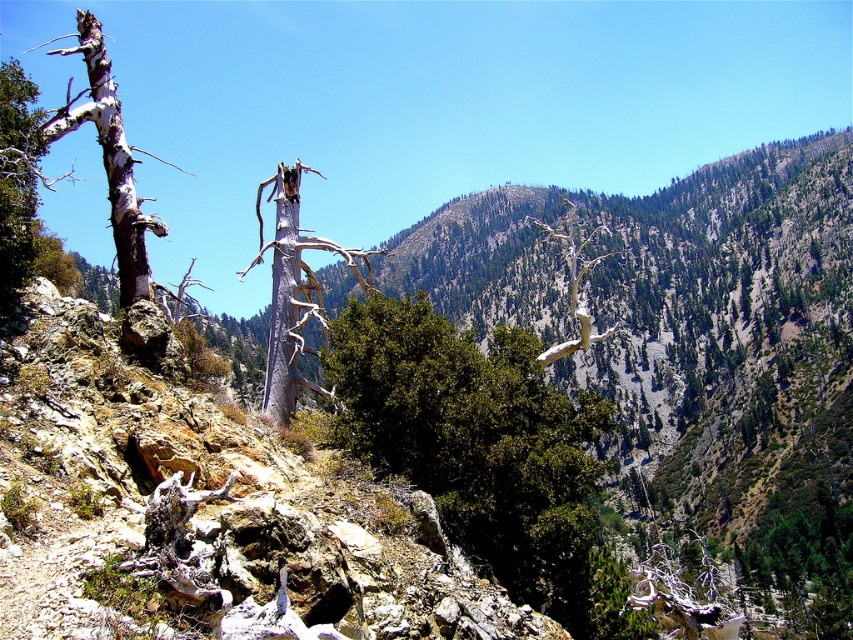
Question: Which point appears closest to the camera in this image?

Choices:
 (A) (502, 328)
 (B) (45, 125)
 (C) (276, 412)

Answer: (B)

Question: Which of these objects is positioned farthest from the gray bark tree at center?

Choices:
 (A) green leafy bush at center
 (B) gray bark tree at left

Answer: (B)

Question: From the image, what is the correct spatial relationship of green leafy bush at center in relation to gray bark tree at left?

Choices:
 (A) right
 (B) left

Answer: (A)

Question: Can you confirm if green leafy bush at center is smaller than gray bark tree at center?

Choices:
 (A) no
 (B) yes

Answer: (B)

Question: Estimate the real-world distances between objects in this image. Which object is closer to the gray bark tree at center?

Choices:
 (A) gray bark tree at left
 (B) green leafy bush at center

Answer: (B)

Question: Is green leafy bush at center bigger than gray bark tree at center?

Choices:
 (A) no
 (B) yes

Answer: (A)